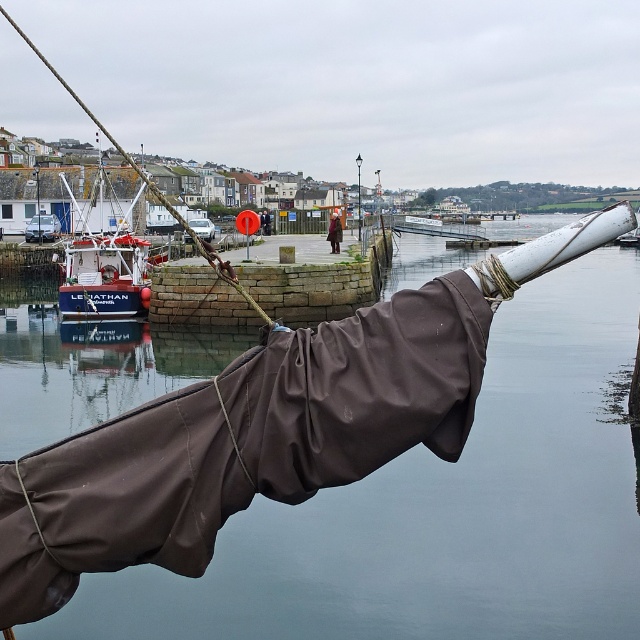
Question: Can you confirm if blue matte fishing boat at left is positioned to the right of white plastic pole at center?

Choices:
 (A) no
 (B) yes

Answer: (A)

Question: Based on their relative distances, which object is nearer to the brown fabric at center?

Choices:
 (A) white plastic pole at center
 (B) transparent water at center
 (C) brown fabric coat at center
 (D) blue matte fishing boat at left

Answer: (C)

Question: Is transparent water at center in front of white plastic pole at center?

Choices:
 (A) yes
 (B) no

Answer: (A)

Question: Can you confirm if blue matte fishing boat at left is positioned above brown fabric coat at center?

Choices:
 (A) yes
 (B) no

Answer: (A)

Question: Which is nearer to the brown fabric at center?

Choices:
 (A) white plastic pole at center
 (B) transparent water at center
 (C) brown fabric coat at center
 (D) blue matte fishing boat at left

Answer: (C)

Question: Estimate the real-world distances between objects in this image. Which object is farther from the brown fabric coat at center?

Choices:
 (A) blue matte fishing boat at left
 (B) transparent water at center

Answer: (B)